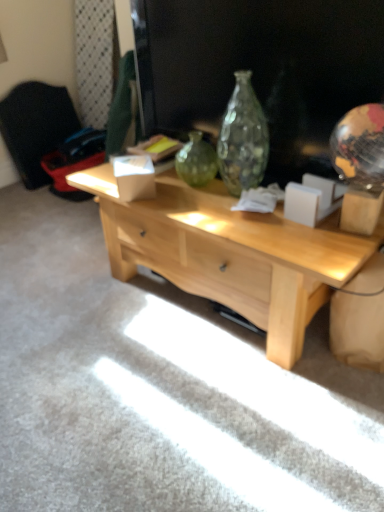
Question: Is light wood desk at center closer to camera compared to black fabric armchair at left?

Choices:
 (A) no
 (B) yes

Answer: (B)

Question: Considering the relative sizes of light wood desk at center and black fabric armchair at left in the image provided, is light wood desk at center thinner than black fabric armchair at left?

Choices:
 (A) yes
 (B) no

Answer: (B)

Question: Is black fabric armchair at left a part of light wood desk at center?

Choices:
 (A) yes
 (B) no

Answer: (B)

Question: Considering the relative sizes of light wood desk at center and black fabric armchair at left in the image provided, is light wood desk at center wider than black fabric armchair at left?

Choices:
 (A) yes
 (B) no

Answer: (A)

Question: Considering the relative sizes of light wood desk at center and black fabric armchair at left in the image provided, is light wood desk at center bigger than black fabric armchair at left?

Choices:
 (A) yes
 (B) no

Answer: (A)

Question: From a real-world perspective, does light wood desk at center sit lower than black fabric armchair at left?

Choices:
 (A) no
 (B) yes

Answer: (B)

Question: Is black fabric armchair at left wider than light wood desk at center?

Choices:
 (A) yes
 (B) no

Answer: (B)

Question: Is black fabric armchair at left smaller than light wood desk at center?

Choices:
 (A) yes
 (B) no

Answer: (A)

Question: Would you consider black fabric armchair at left to be distant from light wood desk at center?

Choices:
 (A) no
 (B) yes

Answer: (B)

Question: Does black fabric armchair at left have a larger size compared to light wood desk at center?

Choices:
 (A) no
 (B) yes

Answer: (A)

Question: From a real-world perspective, is black fabric armchair at left on light wood desk at center?

Choices:
 (A) yes
 (B) no

Answer: (A)

Question: Is black fabric armchair at left facing away from light wood desk at center?

Choices:
 (A) no
 (B) yes

Answer: (A)

Question: From the image's perspective, is light wood desk at center above or below black fabric armchair at left?

Choices:
 (A) above
 (B) below

Answer: (B)